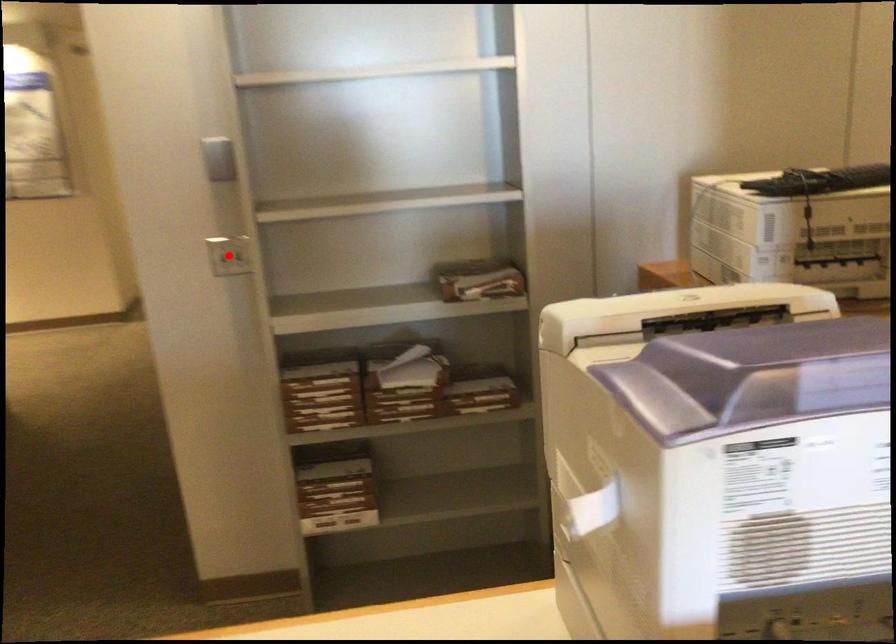
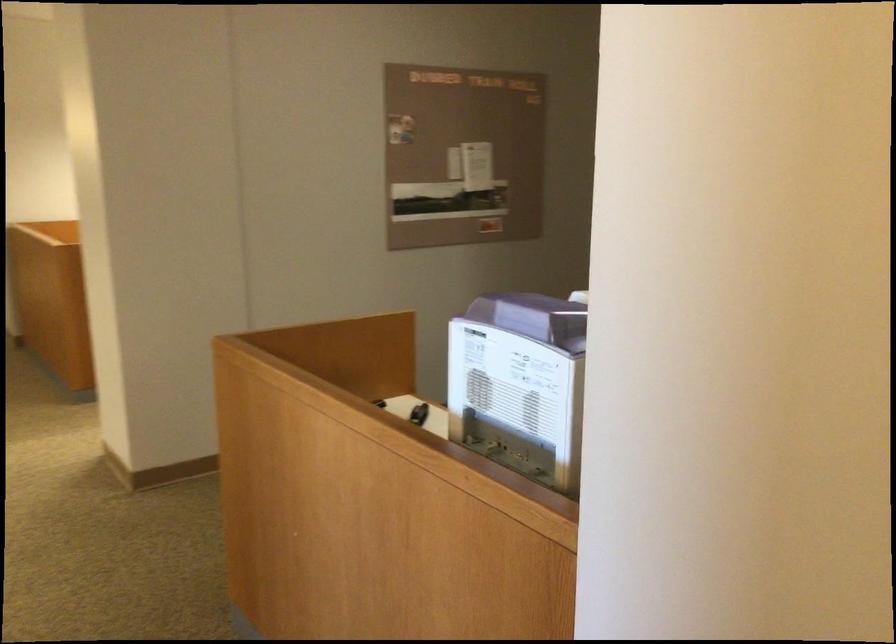
Question: I am providing you with two images of the same scene from different viewpoints. A red point is marked on the first image. Is the red point's position out of view in image 2?

Choices:
 (A) Yes
 (B) No

Answer: (A)